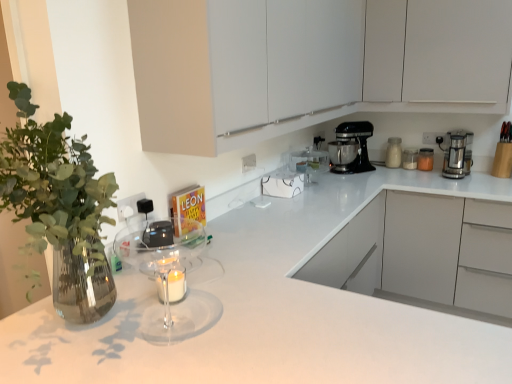
Question: Is white matte cabinet at upper center, the second cabinetry viewed from the front, positioned beyond the bounds of white glossy countertop at center?

Choices:
 (A) no
 (B) yes

Answer: (B)

Question: From the image's perspective, is white matte cabinet at upper center, the second cabinetry viewed from the front, beneath white glossy countertop at center?

Choices:
 (A) no
 (B) yes

Answer: (A)

Question: Can you confirm if white matte cabinet at upper center, arranged as the 1th cabinetry when viewed from the back, is shorter than white glossy countertop at center?

Choices:
 (A) yes
 (B) no

Answer: (A)

Question: Can you confirm if white matte cabinet at upper center, arranged as the 1th cabinetry when viewed from the back, is positioned to the left of white glossy countertop at center?

Choices:
 (A) no
 (B) yes

Answer: (A)

Question: Does white matte cabinet at upper center, arranged as the 1th cabinetry when viewed from the back, lie in front of white glossy countertop at center?

Choices:
 (A) yes
 (B) no

Answer: (B)

Question: Is white matte cabinet at upper center, arranged as the 1th cabinetry when viewed from the back, further to camera compared to white glossy countertop at center?

Choices:
 (A) yes
 (B) no

Answer: (A)

Question: Could you tell me if translucent glass jar at upper right, the second kitchen appliance in the right-to-left sequence, is facing white matte cabinet at upper center, which is the first cabinetry in front-to-back order?

Choices:
 (A) yes
 (B) no

Answer: (B)

Question: Is translucent glass jar at upper right, acting as the 3th kitchen appliance starting from the left, located outside white matte cabinet at upper center, which is the first cabinetry in front-to-back order?

Choices:
 (A) yes
 (B) no

Answer: (A)

Question: From a real-world perspective, does translucent glass jar at upper right, the second kitchen appliance in the right-to-left sequence, stand above white matte cabinet at upper center, which is the first cabinetry in front-to-back order?

Choices:
 (A) no
 (B) yes

Answer: (A)

Question: From a real-world perspective, is translucent glass jar at upper right, acting as the 3th kitchen appliance starting from the left, beneath white matte cabinet at upper center, which is the first cabinetry in front-to-back order?

Choices:
 (A) yes
 (B) no

Answer: (A)

Question: Is translucent glass jar at upper right, acting as the 3th kitchen appliance starting from the left, turned away from white matte cabinet at upper center, the second cabinetry when ordered from back to front?

Choices:
 (A) no
 (B) yes

Answer: (A)

Question: Are translucent glass jar at upper right, acting as the 3th kitchen appliance starting from the left, and white matte cabinet at upper center, the second cabinetry when ordered from back to front, far apart?

Choices:
 (A) no
 (B) yes

Answer: (B)

Question: Does white matte cabinet at upper center, the second cabinetry when ordered from back to front, turn towards white glossy jar at upper right, the third kitchen appliance from the right?

Choices:
 (A) yes
 (B) no

Answer: (B)